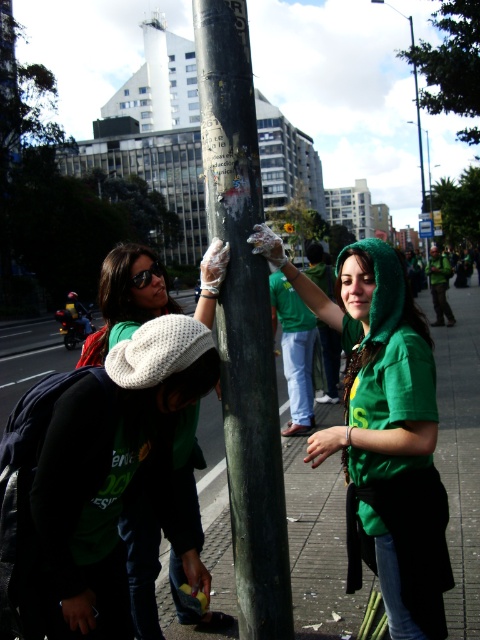
Can you confirm if dark green textured pole at center is positioned to the right of blue plastic sign at upper center?

No, dark green textured pole at center is not to the right of blue plastic sign at upper center.

Between point (215, 145) and point (424, 236), which one is positioned behind?

Point (424, 236)

At what (x,y) coordinates should I click in order to perform the action: click on dark green textured pole at center. Please return your answer as a coordinate pair (x, y). This screenshot has height=640, width=480. Looking at the image, I should click on (243, 321).

Find the location of a particular element. dark green textured pole at center is located at coordinates (243, 321).

Measure the distance between dark green textured pole at center and white knit hat at center.

dark green textured pole at center is 18.17 inches away from white knit hat at center.

Does dark green textured pole at center have a greater width compared to white knit hat at center?

In fact, dark green textured pole at center might be narrower than white knit hat at center.

Between point (238, 243) and point (118, 275), which one is positioned in front?

Point (238, 243) is more forward.

The height and width of the screenshot is (640, 480). Identify the location of dark green textured pole at center. (243, 321).

Which is more to the right, green shiny shirt at center or white knit hat at center?

Positioned to the right is green shiny shirt at center.

The width and height of the screenshot is (480, 640). What do you see at coordinates (372, 362) in the screenshot? I see `green shiny shirt at center` at bounding box center [372, 362].

Which is behind, point (375, 326) or point (188, 618)?

The point (188, 618) is more distant.

The width and height of the screenshot is (480, 640). I want to click on green shiny shirt at center, so click(372, 362).